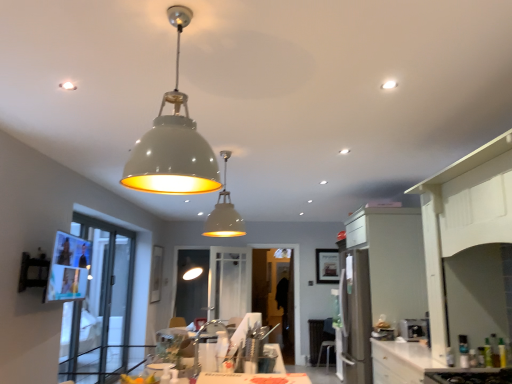
Question: In terms of width, does satin white cabinet at right look wider or thinner when compared to matte white chair at lower center?

Choices:
 (A) thin
 (B) wide

Answer: (B)

Question: Considering the positions of satin white cabinet at right and matte white chair at lower center in the image, is satin white cabinet at right taller or shorter than matte white chair at lower center?

Choices:
 (A) tall
 (B) short

Answer: (A)

Question: Estimate the real-world distances between objects in this image. Which object is farther from the matte white chair at lower center?

Choices:
 (A) satin silver toaster at lower right, the 2th appliance when ordered from right to left
 (B) matte white dome at center, the second lamp when ordered from back to front
 (C) white glossy cabinet at right
 (D) matte white pendant light at center, which appears as the second lamp when viewed from the front
 (E) transparent glass door at center, the 1th glass door viewed from the right

Answer: (B)

Question: Which object is positioned farthest from the transparent glass door at left, arranged as the 2th glass door when viewed from the right?

Choices:
 (A) matte white chair at lower center
 (B) satin silver toaster at lower right, which ranks as the second appliance in left-to-right order
 (C) satin white cabinet at right
 (D) matte white dome at center, which is the 1th lamp from front to back
 (E) satin silver toaster at lower right, the 2th appliance when ordered from right to left

Answer: (A)